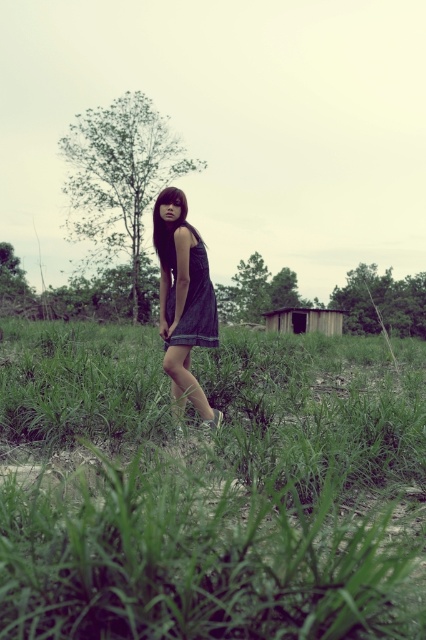
Does point (403, 634) come farther from viewer compared to point (285, 321)?

No, it is not.

Is point (8, 556) in front of point (322, 330)?

That is True.

Locate an element on the screen. green grassy at center is located at coordinates (210, 488).

Which is more to the right, green grassy at center or denim dress at center?

green grassy at center is more to the right.

Is green grassy at center below denim dress at center?

Indeed, green grassy at center is positioned under denim dress at center.

Who is more distant from viewer, (138, 529) or (154, 216)?

The point (154, 216) is behind.

The image size is (426, 640). I want to click on green grassy at center, so tap(210, 488).

Between point (169, 310) and point (296, 310), which one is positioned behind?

The point (296, 310) is more distant.

Between satin dress at center and wooden hut at center, which one is positioned higher?

wooden hut at center is above.

The width and height of the screenshot is (426, 640). In order to click on satin dress at center in this screenshot , I will do `click(196, 305)`.

At what (x,y) coordinates should I click in order to perform the action: click on satin dress at center. Please return your answer as a coordinate pair (x, y). The image size is (426, 640). Looking at the image, I should click on (196, 305).